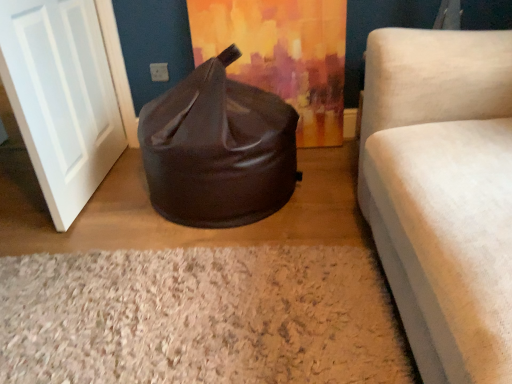
The height and width of the screenshot is (384, 512). I want to click on free region under white shaggy rug at lower center (from a real-world perspective), so click(x=180, y=316).